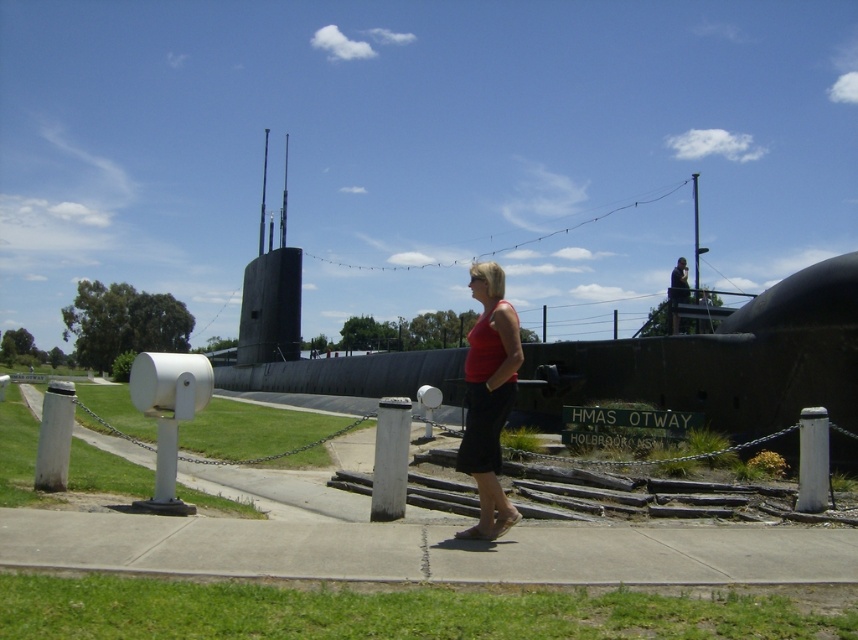
You are standing at the entrance of the submarine base and want to locate the black matte submarine at center. According to the coordinates provided, where should you look?

You should look at point (724,360) to find the black matte submarine at center.

From the picture: You are standing at the point marked by the coordinates point (x=838, y=374) and want to take a photo of the HMAS OTWAY submarine. Considering your camera has a maximum zoom range of 10 meters, will you be able to capture the submarine in your photo without moving closer?

The distance between you and the HMAS OTWAY submarine is 12.22 meters. Since your camera can only zoom up to 10 meters, you will not be able to capture the submarine clearly without moving closer.